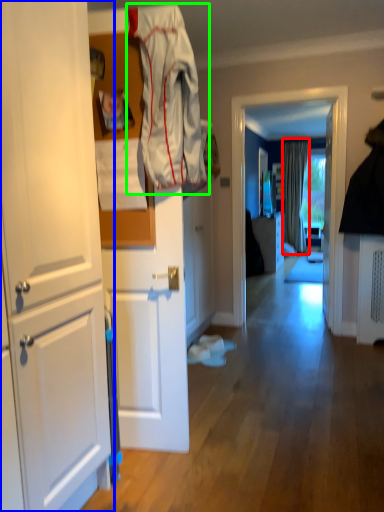
Question: Which is farther away from curtain (highlighted by a red box)? cabinetry (highlighted by a blue box) or clothing (highlighted by a green box)?

Choices:
 (A) cabinetry
 (B) clothing

Answer: (A)